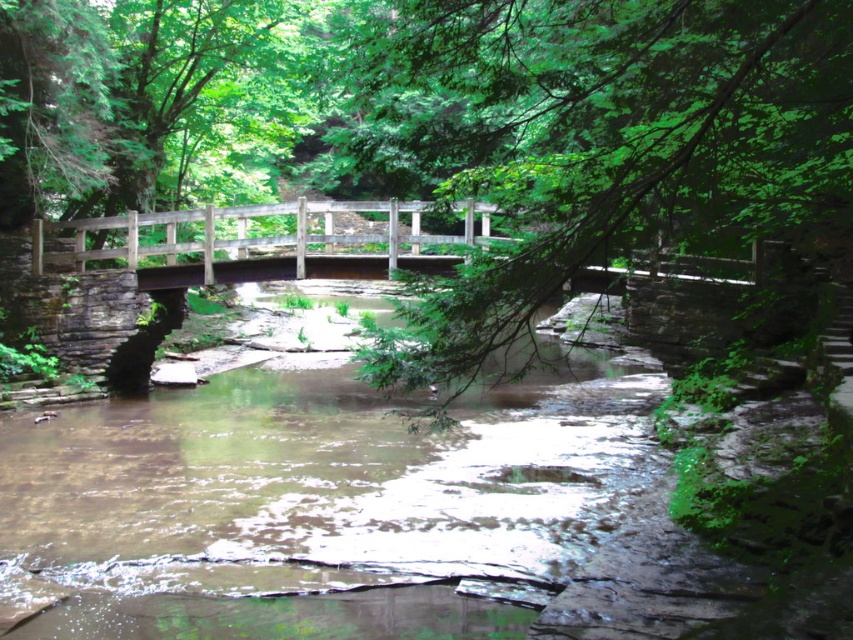
Question: Which point appears closest to the camera in this image?

Choices:
 (A) (483, 216)
 (B) (769, 58)

Answer: (B)

Question: From the image, what is the correct spatial relationship of green leafy branch at center in relation to wooden bridge at center?

Choices:
 (A) left
 (B) right

Answer: (B)

Question: Does green leafy branch at center come in front of wooden bridge at center?

Choices:
 (A) no
 (B) yes

Answer: (B)

Question: Does green leafy branch at center have a larger size compared to wooden bridge at center?

Choices:
 (A) yes
 (B) no

Answer: (B)

Question: Which of the following is the closest to the observer?

Choices:
 (A) green leafy branch at center
 (B) wooden bridge at center

Answer: (A)